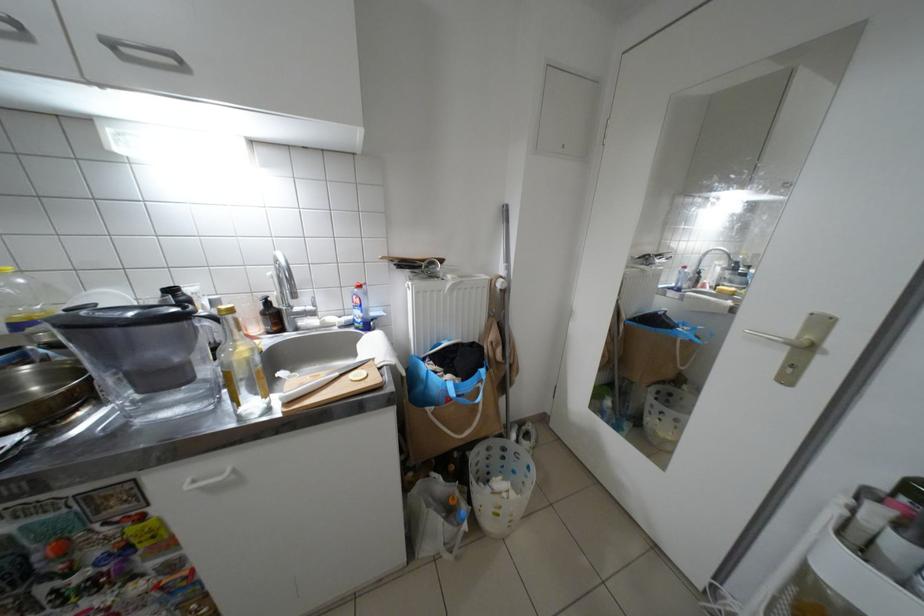
Describe the element at coordinates (712, 257) in the screenshot. This screenshot has height=616, width=924. I see `a faucet handle` at that location.